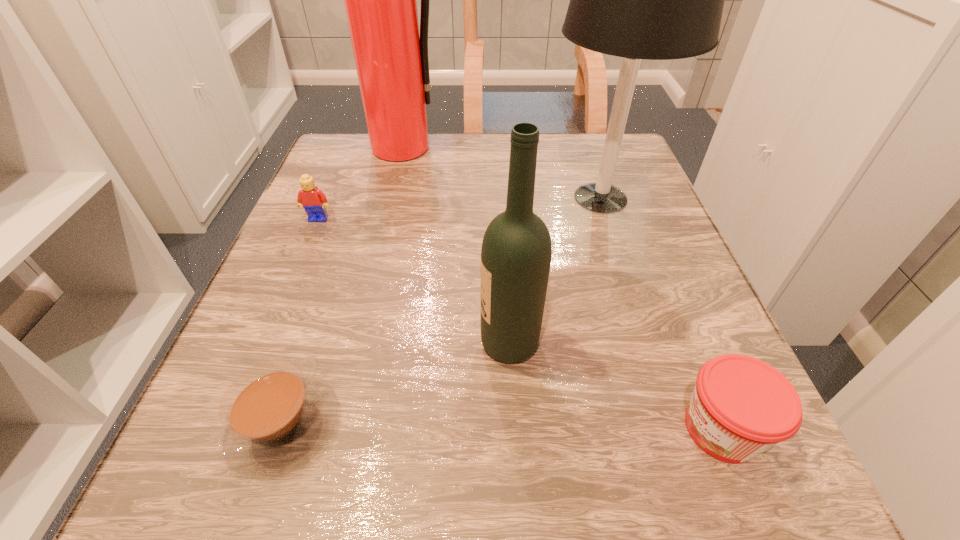
Identify the location of free space between the fire extinguisher and the fourth farthest object. The image size is (960, 540). [x=456, y=245].

At what (x,y) coordinates should I click in order to perform the action: click on free space between the cappuccino and the fire extinguisher. Please return your answer as a coordinate pair (x, y). The width and height of the screenshot is (960, 540). Looking at the image, I should click on (343, 287).

Find the location of `vacant point located between the fire extinguisher and the shortest object`. vacant point located between the fire extinguisher and the shortest object is located at coordinates (343, 287).

This screenshot has width=960, height=540. What are the coordinates of `free spot between the wine bottle and the Lego` in the screenshot? It's located at (414, 281).

Find the location of a particular element. This screenshot has width=960, height=540. free spot between the table lamp and the farthest object is located at coordinates (502, 173).

Locate an element on the screen. The height and width of the screenshot is (540, 960). free area in between the fourth shortest object and the fire extinguisher is located at coordinates (456, 245).

Identify which object is located as the nearest to the fire extinguisher. Please provide its 2D coordinates. Your answer should be formatted as a tuple, i.e. [(x, y)], where the tuple contains the x and y coordinates of a point satisfying the conditions above.

[(313, 200)]

Where is `object identified as the fourth closest to the fourth shortest object`? The image size is (960, 540). object identified as the fourth closest to the fourth shortest object is located at coordinates (313, 200).